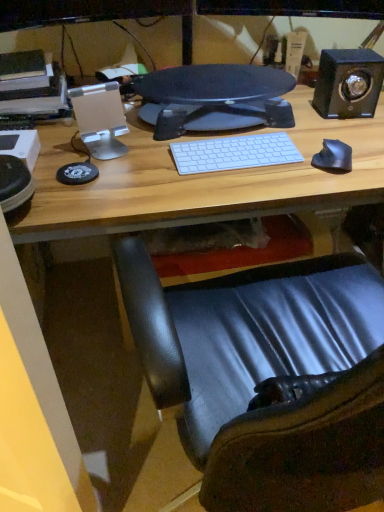
Question: Is shiny black mouse at right thinner than black textured monitor at center?

Choices:
 (A) no
 (B) yes

Answer: (B)

Question: Is shiny black mouse at right at the left side of black textured monitor at center?

Choices:
 (A) yes
 (B) no

Answer: (B)

Question: From the image's perspective, is shiny black mouse at right located above black textured monitor at center?

Choices:
 (A) yes
 (B) no

Answer: (B)

Question: Is black textured monitor at center completely or partially inside shiny black mouse at right?

Choices:
 (A) yes
 (B) no

Answer: (B)

Question: Is shiny black mouse at right positioned beyond the bounds of black textured monitor at center?

Choices:
 (A) no
 (B) yes

Answer: (B)

Question: Would you say black matte speaker at upper right is to the left or to the right of white matte keyboard at center in the picture?

Choices:
 (A) left
 (B) right

Answer: (B)

Question: From the image's perspective, is black matte speaker at upper right positioned above or below white matte keyboard at center?

Choices:
 (A) above
 (B) below

Answer: (A)

Question: In terms of width, does black matte speaker at upper right look wider or thinner when compared to white matte keyboard at center?

Choices:
 (A) thin
 (B) wide

Answer: (B)

Question: In the image, is black matte speaker at upper right positioned in front of or behind white matte keyboard at center?

Choices:
 (A) front
 (B) behind

Answer: (B)

Question: Considering the positions of black textured monitor at center and shiny black mouse at right in the image, is black textured monitor at center taller or shorter than shiny black mouse at right?

Choices:
 (A) tall
 (B) short

Answer: (A)

Question: Considering the positions of point (248, 80) and point (319, 167), is point (248, 80) closer or farther from the camera than point (319, 167)?

Choices:
 (A) closer
 (B) farther

Answer: (B)

Question: Do you think black textured monitor at center is within shiny black mouse at right, or outside of it?

Choices:
 (A) inside
 (B) outside

Answer: (B)

Question: In the image, is black textured monitor at center positioned in front of or behind shiny black mouse at right?

Choices:
 (A) front
 (B) behind

Answer: (B)

Question: In terms of height, does shiny black mouse at right look taller or shorter compared to black matte speaker at upper right?

Choices:
 (A) tall
 (B) short

Answer: (B)

Question: Which is correct: shiny black mouse at right is inside black matte speaker at upper right, or outside of it?

Choices:
 (A) outside
 (B) inside

Answer: (A)